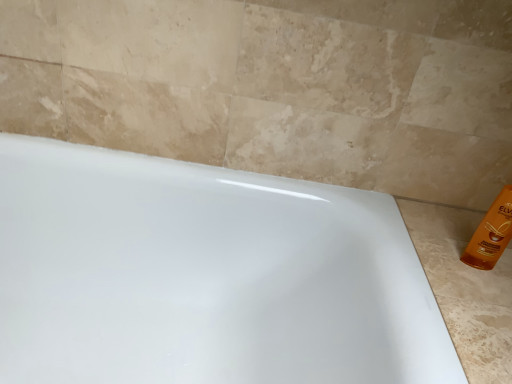
Where is `orange glossy bottle at right`? orange glossy bottle at right is located at coordinates (490, 233).

This screenshot has width=512, height=384. What do you see at coordinates (490, 233) in the screenshot? I see `orange glossy bottle at right` at bounding box center [490, 233].

What is the approximate width of white glossy bathtub at center?

The width of white glossy bathtub at center is 26.74 inches.

This screenshot has width=512, height=384. What are the coordinates of `white glossy bathtub at center` in the screenshot? It's located at (204, 276).

Measure the distance between white glossy bathtub at center and camera.

white glossy bathtub at center and camera are 26.80 inches apart from each other.

The image size is (512, 384). Describe the element at coordinates (204, 276) in the screenshot. I see `white glossy bathtub at center` at that location.

The image size is (512, 384). I want to click on orange glossy bottle at right, so click(x=490, y=233).

Can you confirm if white glossy bathtub at center is positioned to the right of orange glossy bottle at right?

No.

Is white glossy bathtub at center in front of orange glossy bottle at right?

Yes, white glossy bathtub at center is closer to the camera.

Considering the positions of point (365, 312) and point (498, 221), is point (365, 312) closer or farther from the camera than point (498, 221)?

Point (365, 312).

From the image's perspective, between white glossy bathtub at center and orange glossy bottle at right, who is located below?

From the image's view, white glossy bathtub at center is below.

From a real-world perspective, which object rests below the other?

white glossy bathtub at center, from a real-world perspective.

Which of these two, white glossy bathtub at center or orange glossy bottle at right, is thinner?

orange glossy bottle at right is thinner.

Between white glossy bathtub at center and orange glossy bottle at right, which one has more height?

With more height is white glossy bathtub at center.

Between white glossy bathtub at center and orange glossy bottle at right, which one has smaller size?

orange glossy bottle at right is smaller.

In the scene shown: Do you think white glossy bathtub at center is within orange glossy bottle at right, or outside of it?

white glossy bathtub at center cannot be found inside orange glossy bottle at right.

Would you say white glossy bathtub at center is a long distance from orange glossy bottle at right?

Actually, white glossy bathtub at center and orange glossy bottle at right are a little close together.

Is white glossy bathtub at center facing towards orange glossy bottle at right?

No, white glossy bathtub at center does not turn towards orange glossy bottle at right.

Can you tell me how much white glossy bathtub at center and orange glossy bottle at right differ in facing direction?

29.6 degrees.

Locate an element on the screen. cleaning product that is behind the white glossy bathtub at center is located at coordinates (490, 233).

Can you confirm if orange glossy bottle at right is positioned to the left of white glossy bathtub at center?

No, orange glossy bottle at right is not to the left of white glossy bathtub at center.

Is orange glossy bottle at right in front of or behind white glossy bathtub at center in the image?

orange glossy bottle at right is behind white glossy bathtub at center.

Considering the positions of points (480, 248) and (41, 354), is point (480, 248) farther from camera compared to point (41, 354)?

No, it is in front of (41, 354).

From the image's perspective, between orange glossy bottle at right and white glossy bathtub at center, which one is located above?

From the image's view, orange glossy bottle at right is above.

From a real-world perspective, is orange glossy bottle at right positioned under white glossy bathtub at center based on gravity?

Incorrect, from a real-world perspective, orange glossy bottle at right is higher than white glossy bathtub at center.

Can you confirm if orange glossy bottle at right is thinner than white glossy bathtub at center?

Yes.

Considering the relative sizes of orange glossy bottle at right and white glossy bathtub at center in the image provided, is orange glossy bottle at right shorter than white glossy bathtub at center?

Yes, orange glossy bottle at right is shorter than white glossy bathtub at center.

Who is smaller, orange glossy bottle at right or white glossy bathtub at center?

With smaller size is orange glossy bottle at right.

Would you say orange glossy bottle at right is outside white glossy bathtub at center?

Yes.

Is orange glossy bottle at right beside white glossy bathtub at center?

No, orange glossy bottle at right is not with white glossy bathtub at center.

Could you tell me if orange glossy bottle at right is turned towards white glossy bathtub at center?

No, orange glossy bottle at right is not turned towards white glossy bathtub at center.

How different are the orientations of orange glossy bottle at right and white glossy bathtub at center in degrees?

There is a 29.6-degree angle between the facing directions of orange glossy bottle at right and white glossy bathtub at center.

Where is `cleaning product that appears above the white glossy bathtub at center (from the image's perspective)`? The height and width of the screenshot is (384, 512). cleaning product that appears above the white glossy bathtub at center (from the image's perspective) is located at coordinates (490, 233).

Where is `cleaning product positioned vertically above the white glossy bathtub at center (from a real-world perspective)`? The height and width of the screenshot is (384, 512). cleaning product positioned vertically above the white glossy bathtub at center (from a real-world perspective) is located at coordinates (490, 233).

What are the coordinates of `cleaning product on the right of white glossy bathtub at center` in the screenshot? It's located at (490, 233).